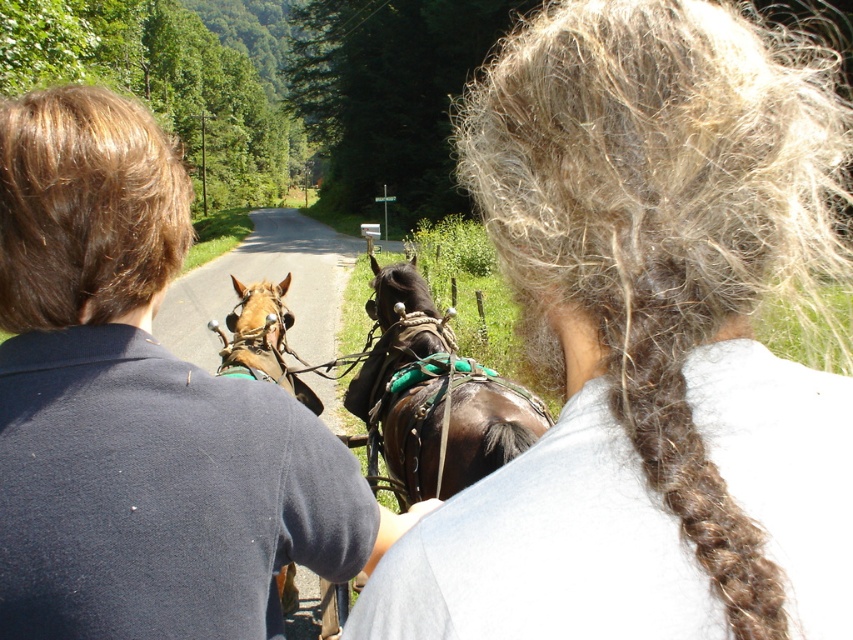
Between point (386, 310) and point (219, 333), which one is positioned behind?

Positioned behind is point (386, 310).

Is shiny brown horse at center smaller than brown leather harness at center?

Actually, shiny brown horse at center might be larger than brown leather harness at center.

What do you see at coordinates (432, 396) in the screenshot? This screenshot has width=853, height=640. I see `shiny brown horse at center` at bounding box center [432, 396].

This screenshot has height=640, width=853. I want to click on shiny brown horse at center, so click(x=432, y=396).

Is brown leather coach at center to the right of brown leather harness at center from the viewer's perspective?

Correct, you'll find brown leather coach at center to the right of brown leather harness at center.

Is brown leather coach at center positioned before brown leather harness at center?

Yes, brown leather coach at center is in front of brown leather harness at center.

Locate an element on the screen. brown leather coach at center is located at coordinates (138, 408).

What are the coordinates of `brown leather coach at center` in the screenshot? It's located at (138, 408).

Who is taller, brown leather coach at center or shiny brown horse at center?

shiny brown horse at center

Does brown leather coach at center have a lesser width compared to shiny brown horse at center?

Correct, brown leather coach at center's width is less than shiny brown horse at center's.

Is point (148, 230) farther from viewer compared to point (498, 420)?

No, it is not.

At what (x,y) coordinates should I click in order to perform the action: click on brown leather coach at center. Please return your answer as a coordinate pair (x, y). This screenshot has height=640, width=853. Looking at the image, I should click on (138, 408).